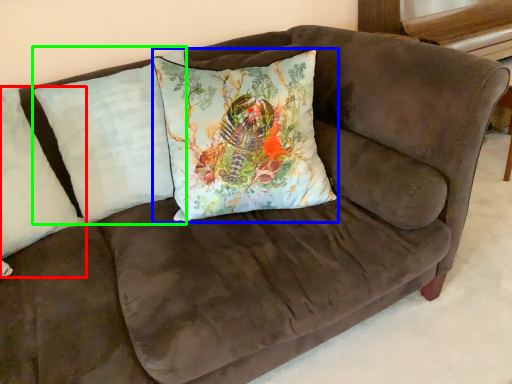
Question: Estimate the real-world distances between objects in this image. Which object is farther from pillow (highlighted by a red box), pillow (highlighted by a blue box) or pillow (highlighted by a green box)?

Choices:
 (A) pillow
 (B) pillow

Answer: (A)